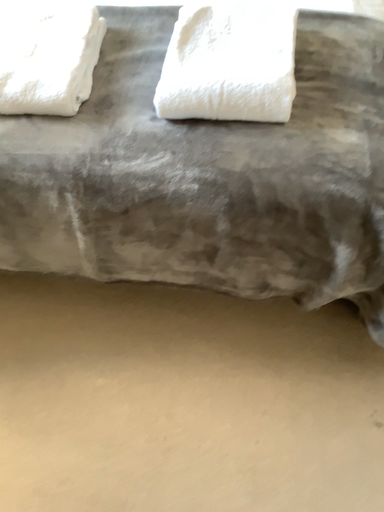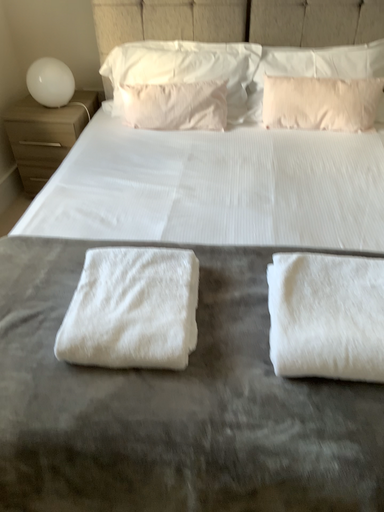
Question: How did the camera likely rotate when shooting the video?

Choices:
 (A) rotated downward
 (B) rotated upward

Answer: (B)